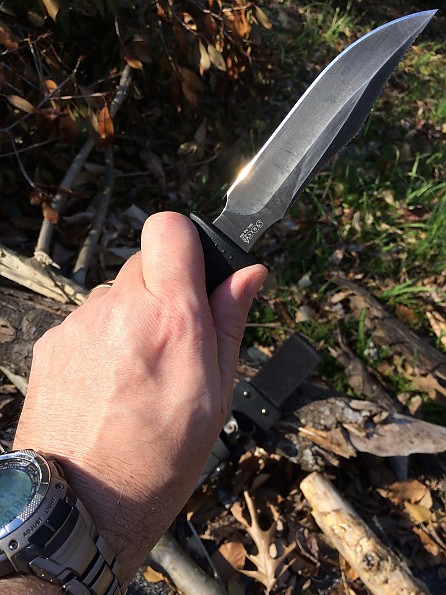
Where is `handle`? Image resolution: width=446 pixels, height=595 pixels. handle is located at coordinates (212, 253).